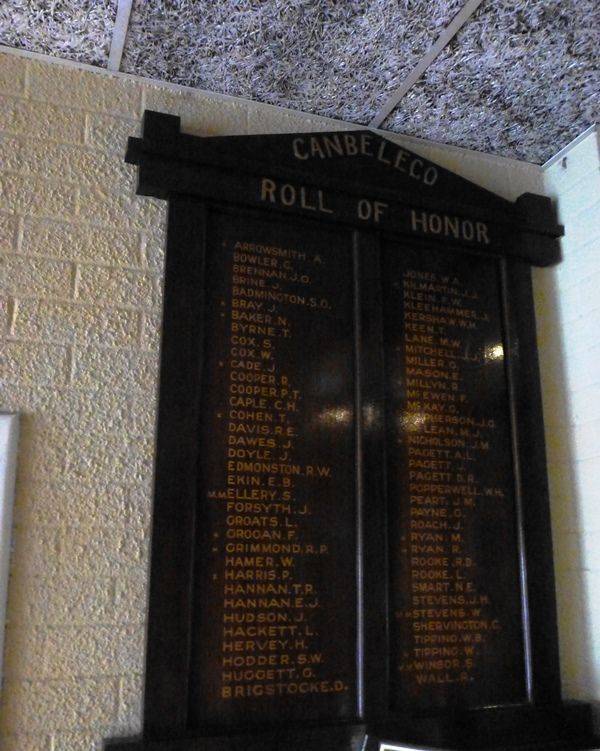
Identify the location of reflection of a light. This screenshot has height=751, width=600. (498, 350).